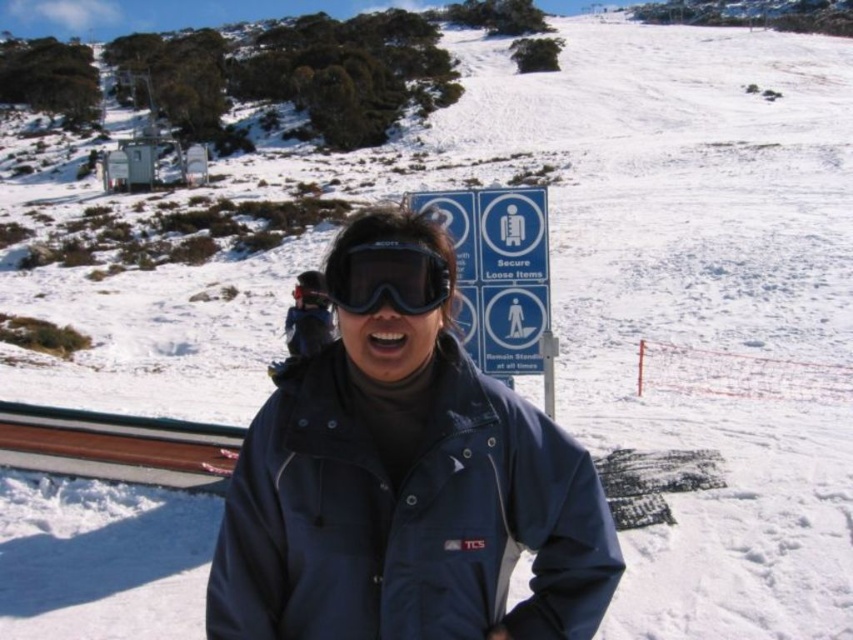
Is navy blue jacket at center smaller than blue plastic sign at center?

No.

Can you confirm if navy blue jacket at center is positioned above blue plastic sign at center?

Actually, navy blue jacket at center is below blue plastic sign at center.

Locate an element on the screen. The width and height of the screenshot is (853, 640). navy blue jacket at center is located at coordinates (408, 516).

From the picture: Is navy blue jacket at center above black matte goggles at center?

No.

Does point (525, 492) come in front of point (392, 269)?

No, (525, 492) is behind (392, 269).

Describe the element at coordinates (408, 516) in the screenshot. I see `navy blue jacket at center` at that location.

Where is `navy blue jacket at center`? navy blue jacket at center is located at coordinates [408, 516].

Based on the photo, does blue plastic sign at center lie behind black matte goggles at center?

Yes.

Is point (476, 314) closer to camera compared to point (341, 304)?

That is False.

Where is `blue plastic sign at center`? This screenshot has width=853, height=640. blue plastic sign at center is located at coordinates (497, 272).